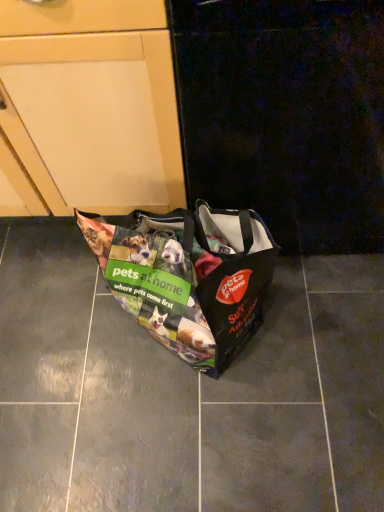
This screenshot has height=512, width=384. What do you see at coordinates (188, 276) in the screenshot?
I see `polyester tote bag at center` at bounding box center [188, 276].

In order to face polyester tote bag at center, should I rotate leftwards or rightwards?

To face it directly, rotate left by 1.920 degrees.

Locate an element on the screen. The height and width of the screenshot is (512, 384). polyester tote bag at center is located at coordinates [188, 276].

Image resolution: width=384 pixels, height=512 pixels. I want to click on polyester tote bag at center, so click(188, 276).